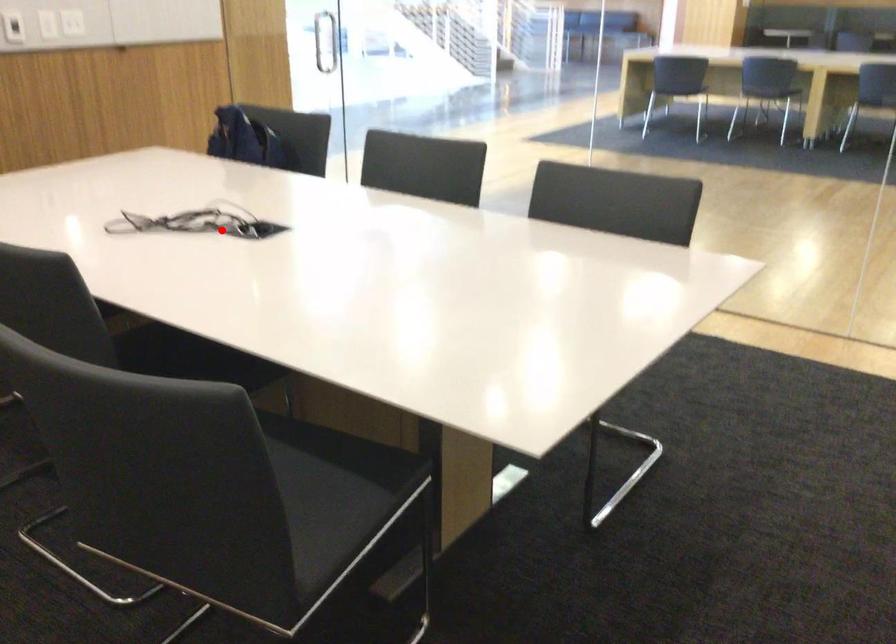
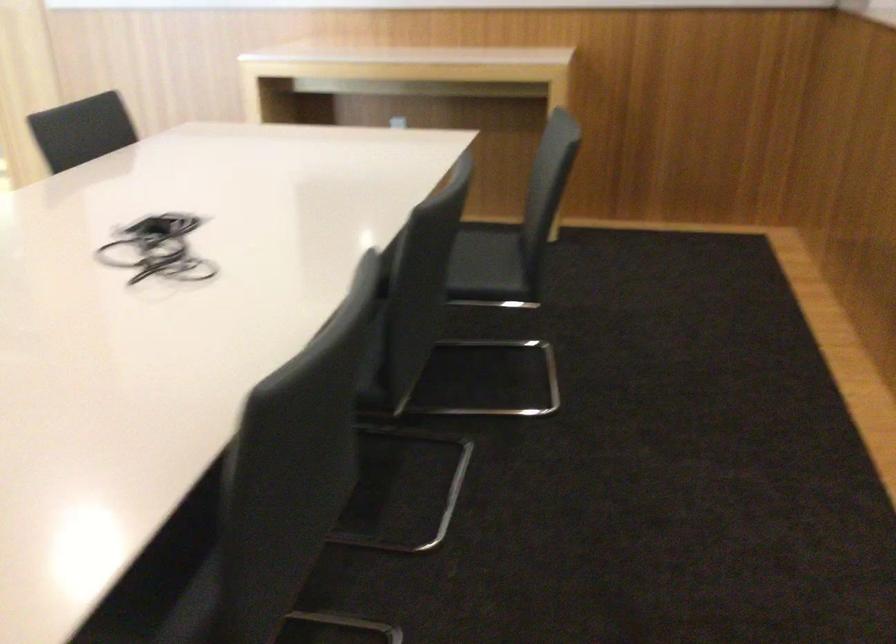
Question: I am providing you with two images of the same scene from different viewpoints. A red point is shown in image1. For the corresponding object point in image2, is it positioned nearer or farther from the camera?

Choices:
 (A) Nearer
 (B) Farther

Answer: (A)